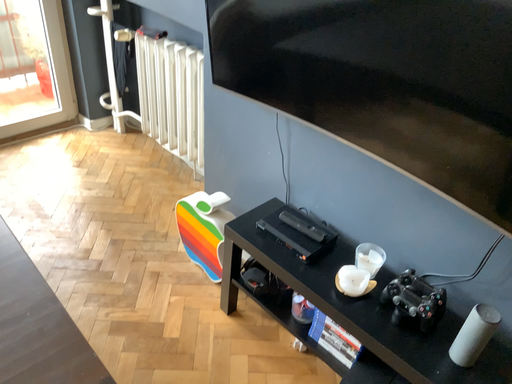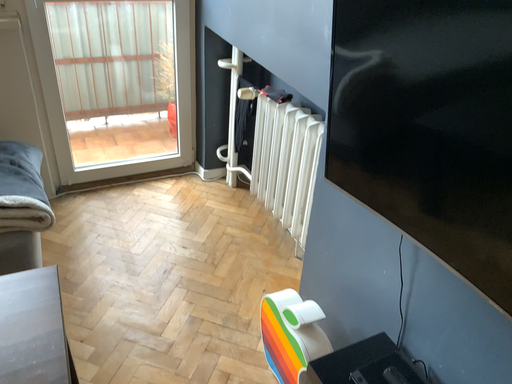
Question: Which way did the camera rotate in the video?

Choices:
 (A) rotated left
 (B) rotated right

Answer: (A)